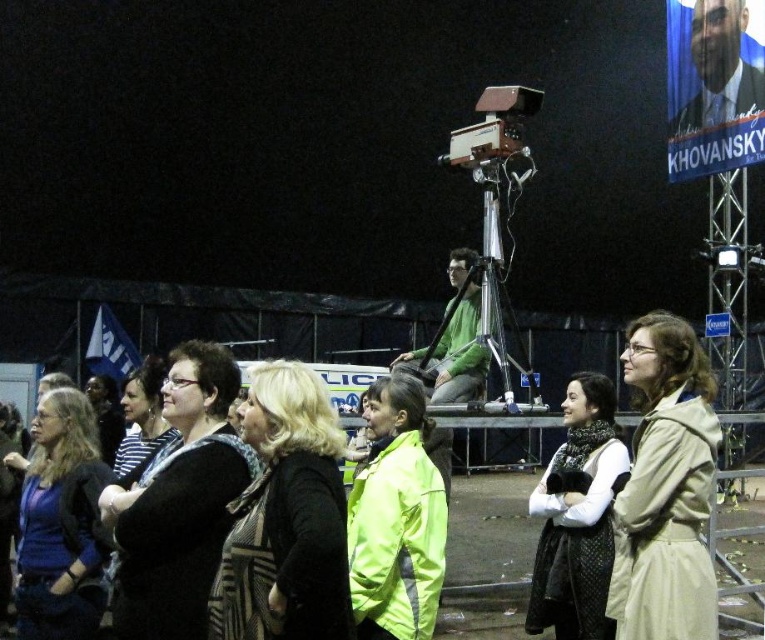
You are a photographer at the event and want to capture a photo that includes both the beige fabric coat at right and the knitted scarf at center. Which object should you focus on first to ensure both are in frame?

The beige fabric coat at right is located above the knitted scarf at center, so you should focus on the knitted scarf at center first to ensure both are in frame.

From the picture: You are at the event and want to take a photo of both the black knitwear at center and the matte black jacket at center. Since they are both at the center, how can you ensure both are visible in the frame?

The black knitwear at center is below the matte black jacket at center, so you can adjust your camera angle to capture both by positioning it to include the space above and below the center area where both objects are located.